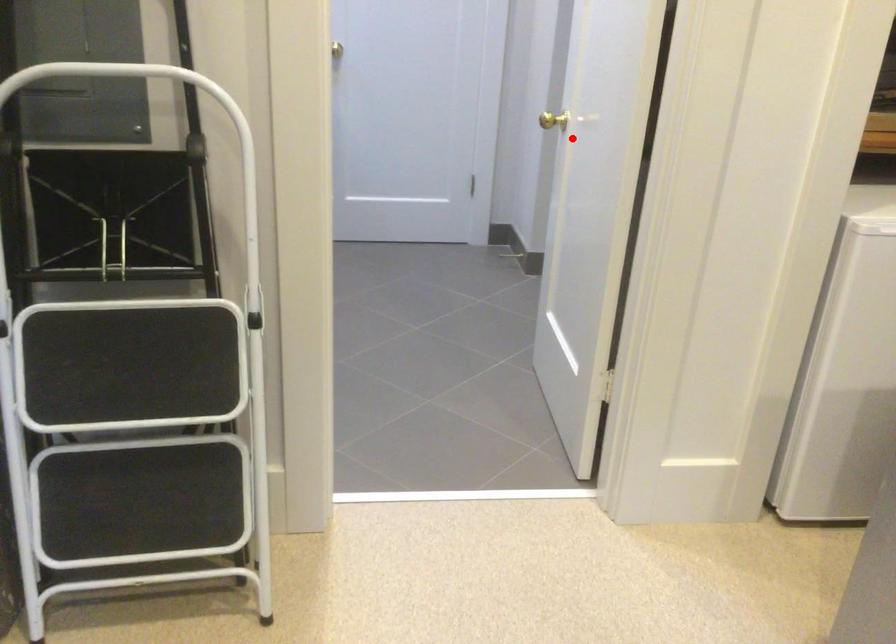
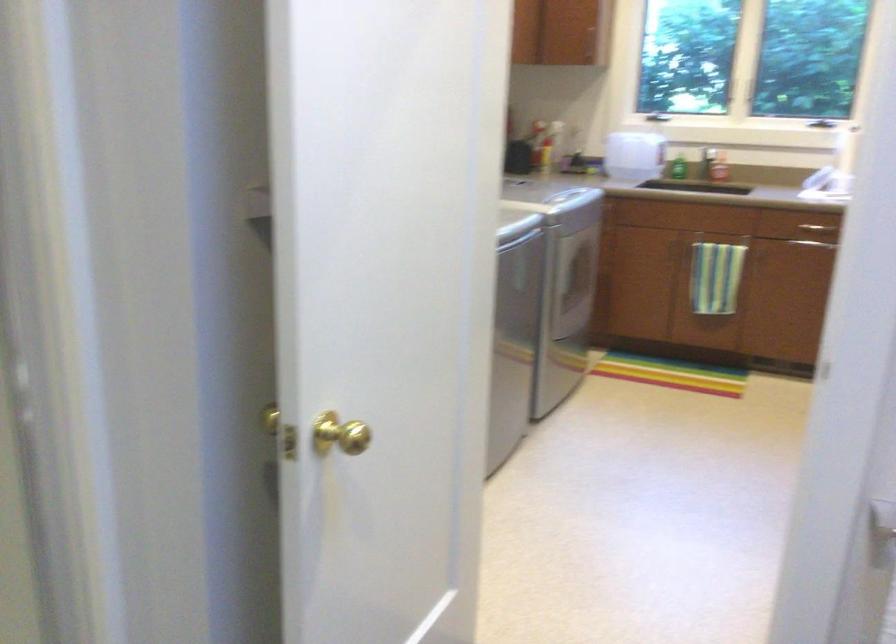
Find the pixel in the second image that matches the highlighted location in the first image.

(339, 433)